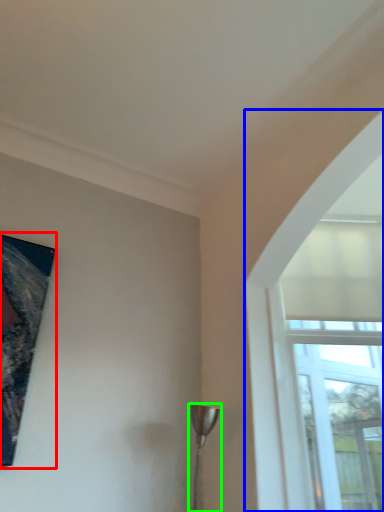
Question: Estimate the real-world distances between objects in this image. Which object is farther from picture frame (highlighted by a red box), window (highlighted by a blue box) or lamp (highlighted by a green box)?

Choices:
 (A) window
 (B) lamp

Answer: (A)